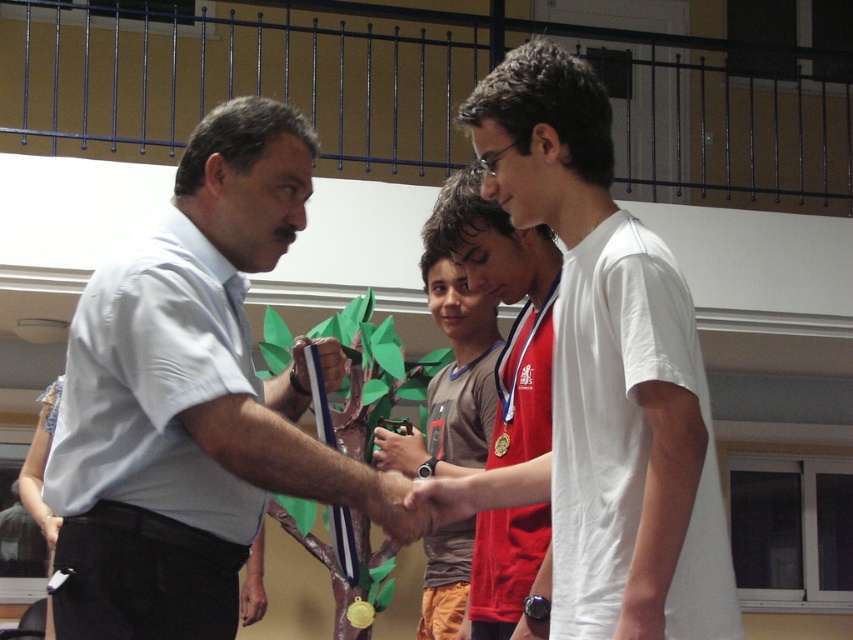
Question: Is white cotton t-shirt at center to the left of brown fabric shirt at center from the viewer's perspective?

Choices:
 (A) yes
 (B) no

Answer: (B)

Question: Which of the following is the farthest from the observer?

Choices:
 (A) matte red shirt at center
 (B) brown fabric shirt at center
 (C) white cotton t-shirt at center
 (D) light blue shirt at center

Answer: (B)

Question: Among these objects, which one is farthest from the camera?

Choices:
 (A) matte red shirt at center
 (B) white cotton t-shirt at center

Answer: (A)

Question: Does light blue shirt at center appear on the right side of white cotton t-shirt at center?

Choices:
 (A) yes
 (B) no

Answer: (B)

Question: Can you confirm if light blue shirt at center is smaller than matte red shirt at center?

Choices:
 (A) yes
 (B) no

Answer: (B)

Question: Which point is closer to the camera taking this photo?

Choices:
 (A) (229, 280)
 (B) (511, 397)
 (C) (672, 508)
 (D) (476, 417)

Answer: (C)